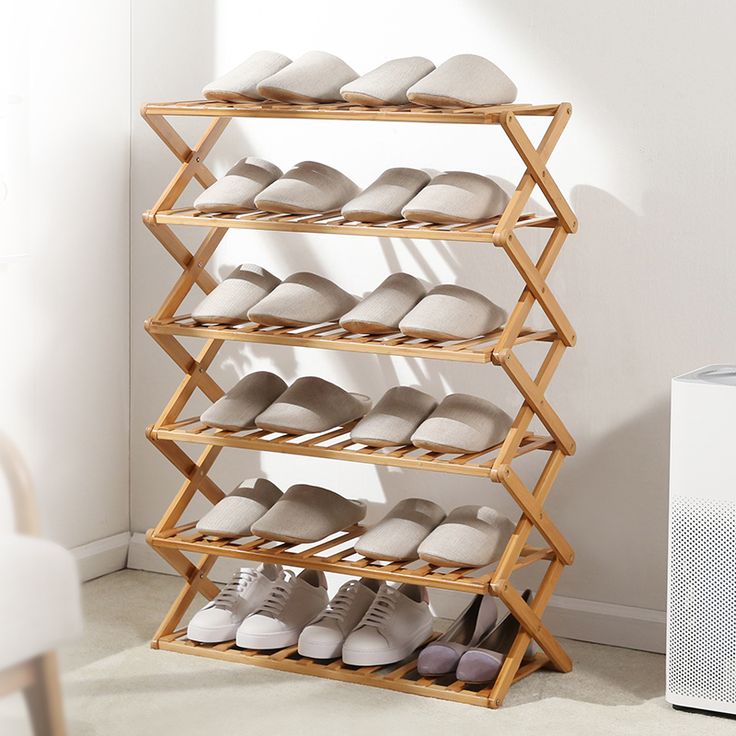
What are the coordinates of `right slipper` in the screenshot? It's located at (233, 82), (382, 82), (371, 191), (236, 187), (233, 293), (371, 308), (241, 394), (391, 417), (232, 503), (392, 537).